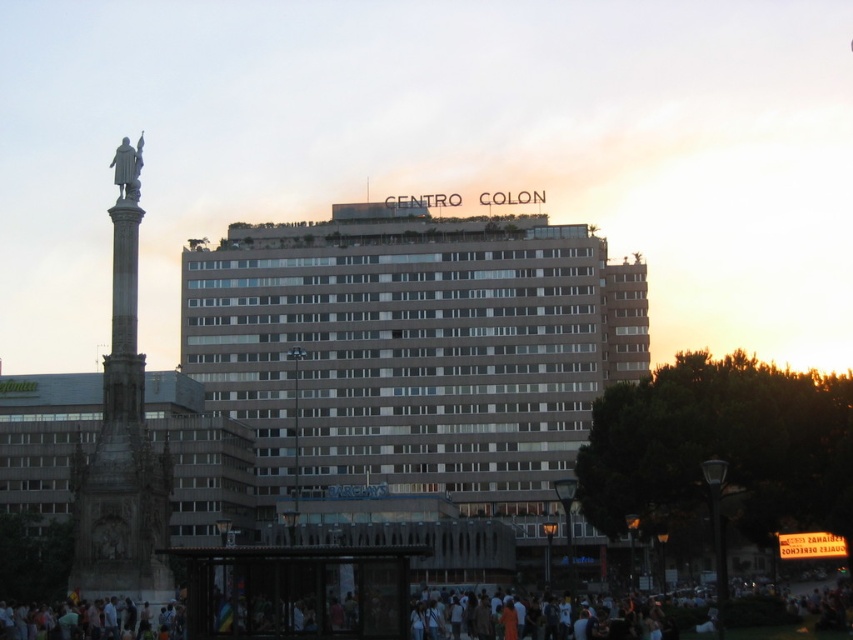
Question: Where is beige concrete building at center located in relation to polished stone column at left in the image?

Choices:
 (A) right
 (B) left

Answer: (A)

Question: From the image, what is the correct spatial relationship of beige concrete building at center in relation to bronze statue at upper left?

Choices:
 (A) right
 (B) left

Answer: (A)

Question: Which point is closer to the camera taking this photo?

Choices:
 (A) (102, 449)
 (B) (125, 157)

Answer: (A)

Question: Which point is farther to the camera?

Choices:
 (A) (90, 456)
 (B) (839, 611)
 (C) (122, 141)

Answer: (C)

Question: Is beige concrete building at center to the left of white cotton crowd at lower center from the viewer's perspective?

Choices:
 (A) yes
 (B) no

Answer: (A)

Question: Which of the following is the farthest from the observer?

Choices:
 (A) (474, 236)
 (B) (840, 609)
 (C) (134, 320)
 (D) (129, 154)

Answer: (A)